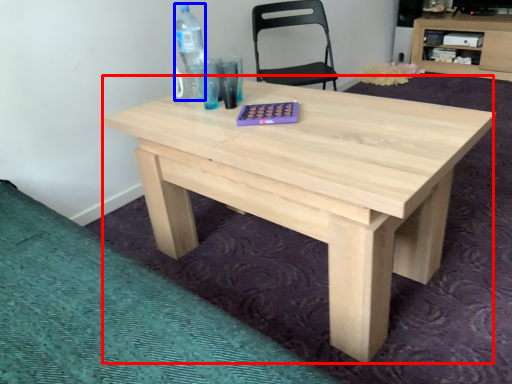
Question: Among these objects, which one is nearest to the camera, table (highlighted by a red box) or bottle (highlighted by a blue box)?

Choices:
 (A) table
 (B) bottle

Answer: (A)